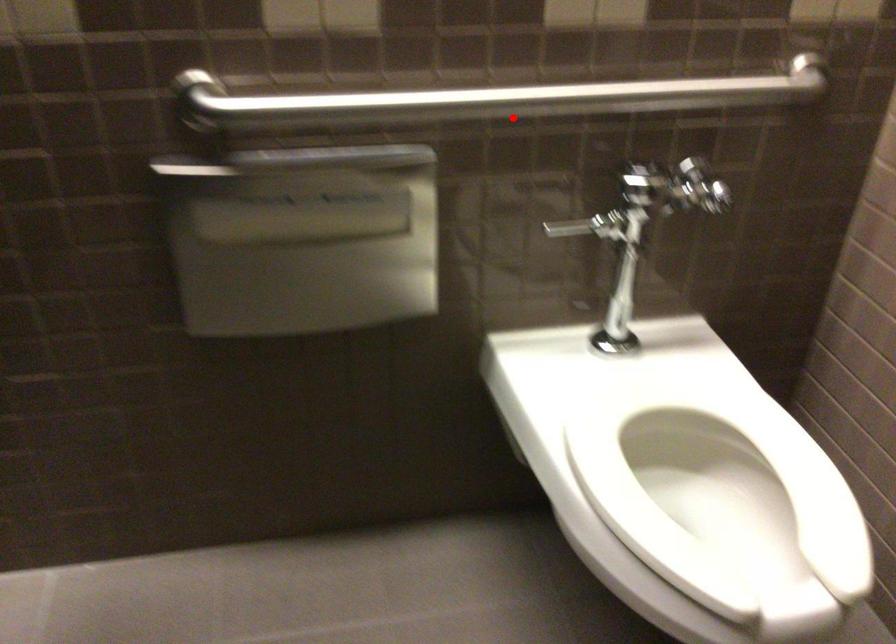
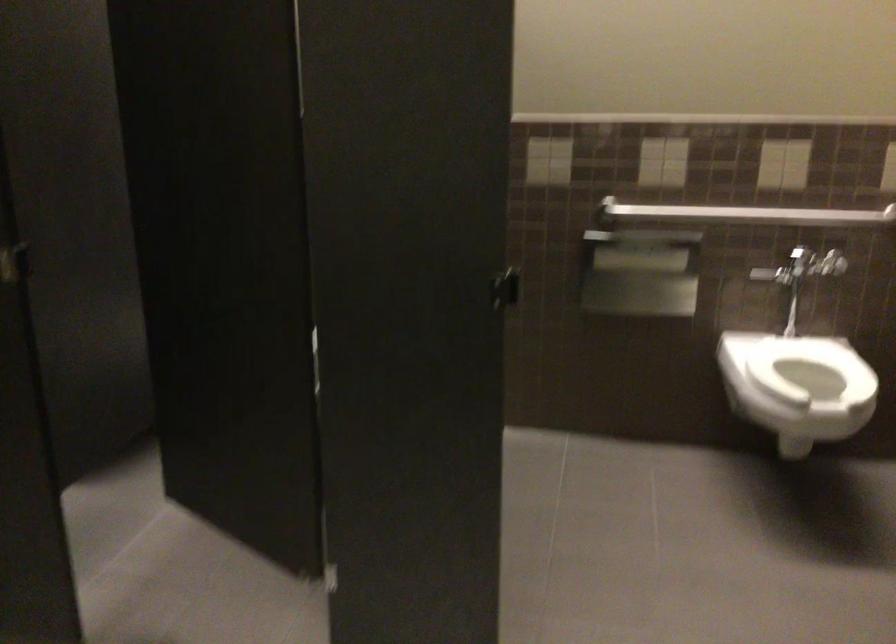
Where in the second image is the point corresponding to the highlighted location from the first image?

(745, 214)